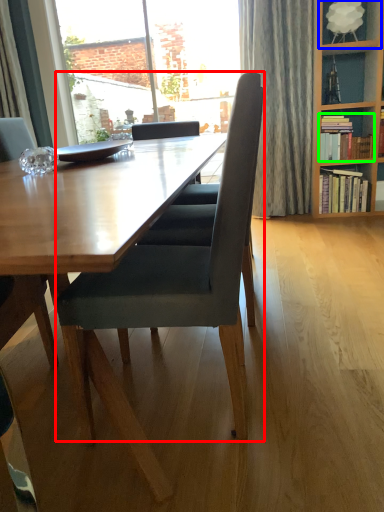
Question: Estimate the real-world distances between objects in this image. Which object is farther from chair (highlighted by a red box), shelf (highlighted by a blue box) or book (highlighted by a green box)?

Choices:
 (A) shelf
 (B) book

Answer: (A)